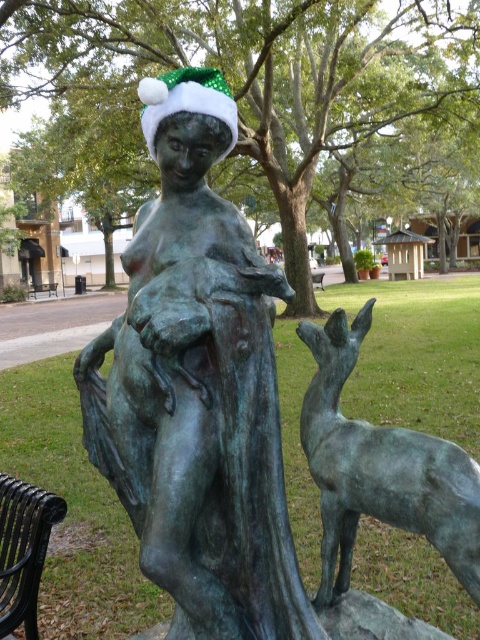
You are a visitor at the park and want to take a photo of the green patina deer at center and the black metal park bench at center together in the frame. Which object should you position closer to the camera to include both in the shot?

To include both the green patina deer at center and the black metal park bench at center in the frame, position the black metal park bench at center closer to the camera since the green patina deer at center is to the left of it, allowing both to be captured in the same shot.

You are a visitor in the park and want to take a photo of the bronze statue at center without any obstructions. Since you are standing at the front of the black metal park bench at center, is there anything blocking your view of the statue?

The bronze statue at center is located below the black metal park bench at center, so when you are standing at the front of the bench, the bench itself may block your direct line of sight to the statue. You might need to move to a position where the bench is not between you and the statue to get an unobstructed photo.